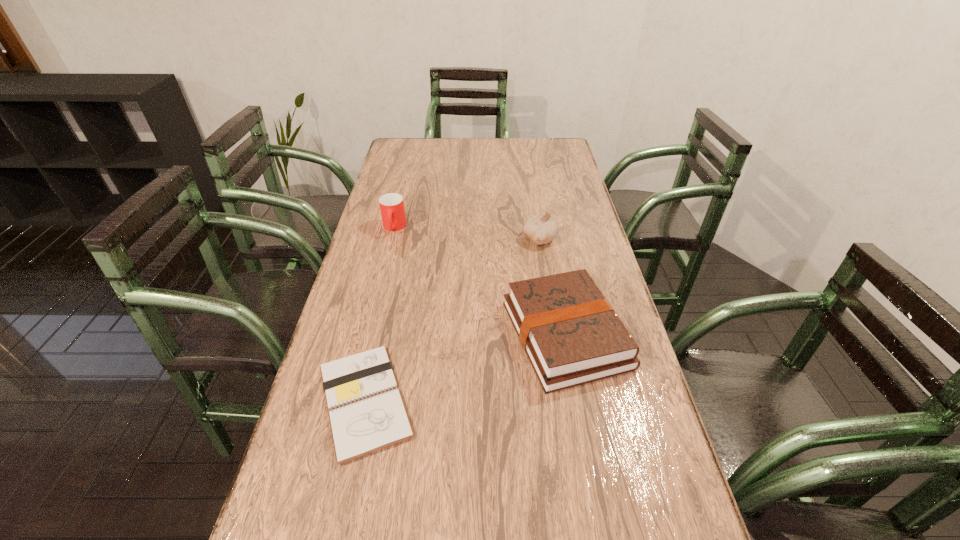
At what (x,y) coordinates should I click in order to perform the action: click on free spot between the second shortest object and the notepad. Please return your answer as a coordinate pair (x, y). The image size is (960, 540). Looking at the image, I should click on (466, 368).

You are a GUI agent. You are given a task and a screenshot of the screen. Output one action in this format:
    pyautogui.click(x=<x>, y=<y>)
    Task: Click on the empty location between the notepad and the second shortest object
    The width and height of the screenshot is (960, 540).
    Given the screenshot: What is the action you would take?
    pyautogui.click(x=466, y=368)

This screenshot has height=540, width=960. What are the coordinates of `free area in between the garlic and the cup` in the screenshot? It's located at (467, 233).

Find the location of a particular element. The image size is (960, 540). vacant space that is in between the hardback book and the cup is located at coordinates [x=480, y=281].

In order to click on free space between the cup and the garlic in this screenshot , I will do pyautogui.click(x=467, y=233).

At what (x,y) coordinates should I click in order to perform the action: click on vacant area between the cup and the hardback book. Please return your answer as a coordinate pair (x, y). The height and width of the screenshot is (540, 960). Looking at the image, I should click on (480, 281).

The image size is (960, 540). I want to click on object that is the closest to the shortest object, so click(572, 336).

Locate which object ranks second in proximity to the garlic. Please provide its 2D coordinates. Your answer should be formatted as a tuple, i.e. [(x, y)], where the tuple contains the x and y coordinates of a point satisfying the conditions above.

[(391, 205)]

At what (x,y) coordinates should I click in order to perform the action: click on vacant region that satisfies the following two spatial constraints: 1. on the back side of the hardback book; 2. on the right side of the shortest object. Please return your answer as a coordinate pair (x, y). Looking at the image, I should click on (379, 335).

Where is `blank space that satisfies the following two spatial constraints: 1. on the side of the garlic with the handle; 2. on the left side of the cup`? The image size is (960, 540). blank space that satisfies the following two spatial constraints: 1. on the side of the garlic with the handle; 2. on the left side of the cup is located at coordinates (391, 239).